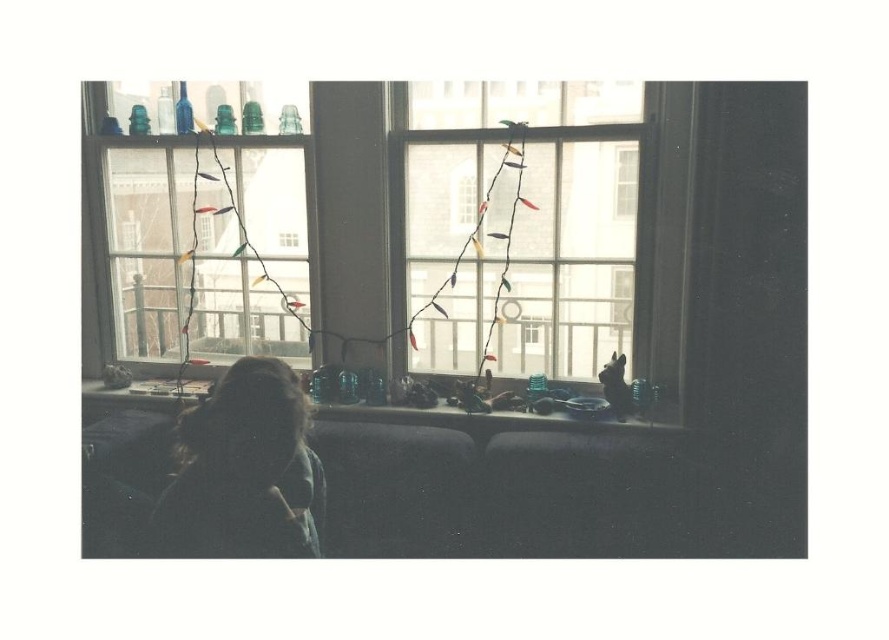
You are a photographer trying to capture the dark hair at lower left and the clear glass window at upper center in a single frame. Given their relative sizes, which object will appear larger in the photo?

The dark hair at lower left will appear larger in the photo because it is much taller than the clear glass window at upper center.

You are an interior designer assessing the lighting in a room. You notice the transparent glass window at center and the translucent glass window at center. Which window allows more natural light into the room?

The transparent glass window at center allows more natural light into the room because it is larger in size than the translucent glass window at center.

You are trying to place a small potted plant on the windowsill. The translucent glass objects at lower center are currently occupying space there. Can the clear glass window at center accommodate the plant instead?

The clear glass window at center might be wider than the translucent glass objects at lower center, so it could potentially accommodate the plant if placed there instead.